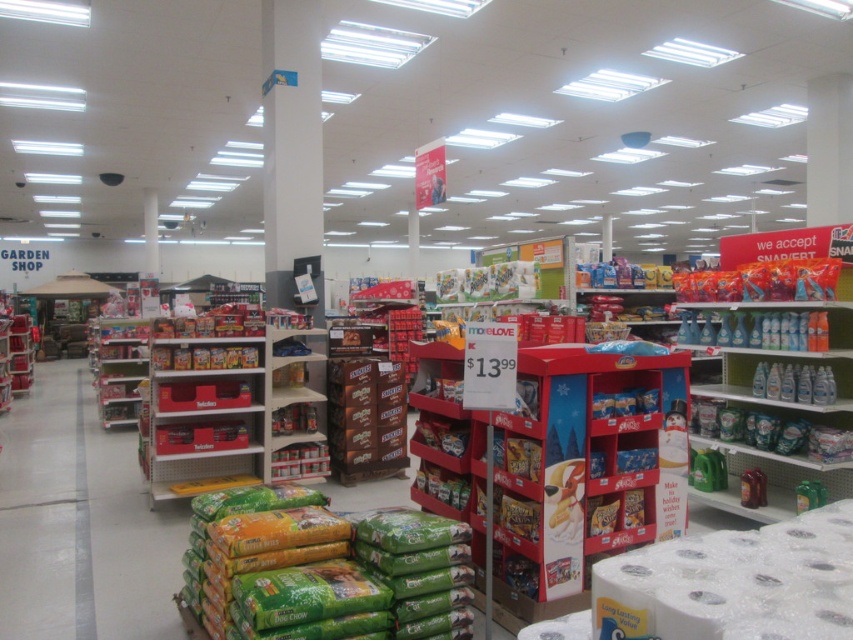
Is white matte toilet paper at lower right further to camera compared to white glossy aisle at center?

No.

Is white matte toilet paper at lower right below white glossy aisle at center?

No.

Between point (656, 620) and point (28, 476), which one is positioned in front?

Positioned in front is point (656, 620).

Where is `white matte toilet paper at lower right`? The height and width of the screenshot is (640, 853). white matte toilet paper at lower right is located at coordinates (734, 582).

Can you confirm if green matte dog chow at lower center is thinner than white matte toilet paper at lower right?

In fact, green matte dog chow at lower center might be wider than white matte toilet paper at lower right.

Is green matte dog chow at lower center behind white matte toilet paper at lower right?

That is True.

Which is in front, point (270, 508) or point (833, 502)?

Point (833, 502)

Locate an element on the screen. green matte dog chow at lower center is located at coordinates coord(323,570).

From the picture: Can you confirm if green matte dog chow at lower center is positioned above clear plastic bottles at upper right?

No, green matte dog chow at lower center is not above clear plastic bottles at upper right.

Who is more forward, (459, 561) or (786, 346)?

Point (459, 561) is more forward.

You are a GUI agent. You are given a task and a screenshot of the screen. Output one action in this format:
    pyautogui.click(x=<x>, y=<y>)
    Task: Click on the green matte dog chow at lower center
    
    Given the screenshot: What is the action you would take?
    pyautogui.click(x=323, y=570)